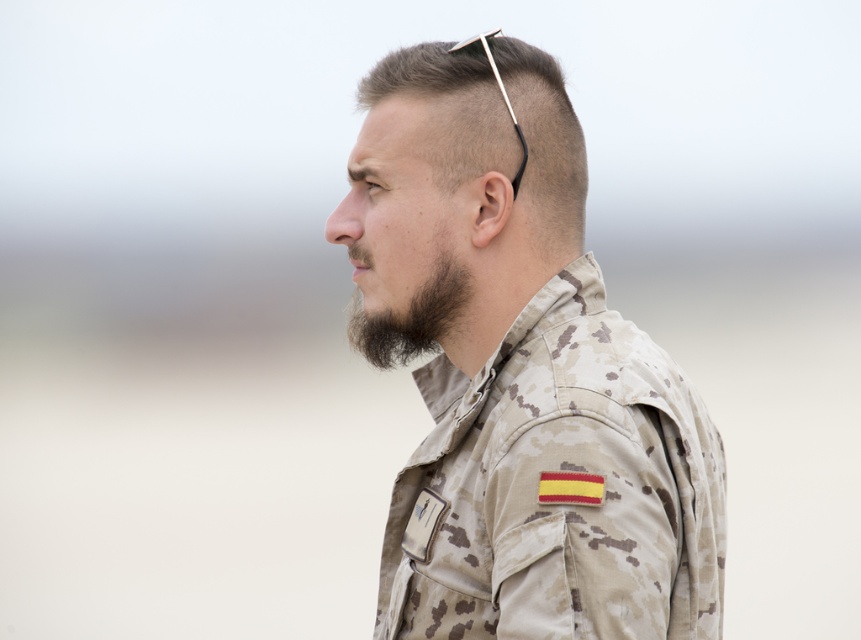
Question: Which point appears closest to the camera in this image?

Choices:
 (A) (367, 145)
 (B) (352, 253)

Answer: (A)

Question: Is camouflage uniform at center in front of dark brown fuzzy beard at lower left?

Choices:
 (A) yes
 (B) no

Answer: (A)

Question: Among these objects, which one is nearest to the camera?

Choices:
 (A) camouflage uniform at center
 (B) dark brown fuzzy beard at lower left
 (C) camouflage fabric head at center

Answer: (A)

Question: Can you confirm if camouflage uniform at center is positioned to the right of camouflage fabric head at center?

Choices:
 (A) yes
 (B) no

Answer: (A)

Question: Which of the following is the farthest from the observer?

Choices:
 (A) (609, 476)
 (B) (429, 321)

Answer: (B)

Question: Can you confirm if camouflage uniform at center is positioned above camouflage fabric head at center?

Choices:
 (A) no
 (B) yes

Answer: (A)